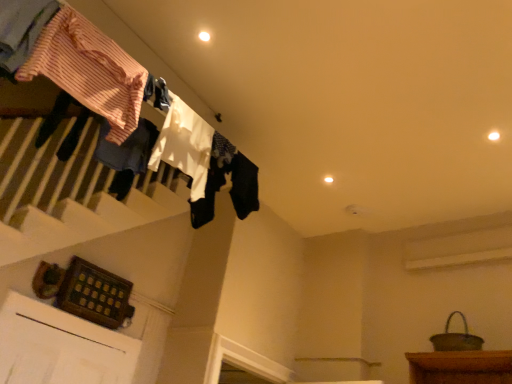
Question: In the image, is striped cotton shirt at upper left, positioned as the 1th clothing in front-to-back order, positioned in front of or behind white cotton socks at upper center, which is the 1th clothing in back-to-front order?

Choices:
 (A) behind
 (B) front

Answer: (B)

Question: From the image's perspective, is striped cotton shirt at upper left, positioned as the 1th clothing in front-to-back order, located above or below white cotton socks at upper center, arranged as the fourth clothing when viewed from the front?

Choices:
 (A) below
 (B) above

Answer: (B)

Question: Which object is the farthest from the striped cotton shirt at upper left, positioned as the 1th clothing in front-to-back order?

Choices:
 (A) white cotton socks at upper center, which is the 1th clothing in back-to-front order
 (B) striped cotton shirt at upper left, the third clothing in the back-to-front sequence
 (C) white fabric at upper center, the 3th clothing in the front-to-back sequence

Answer: (A)

Question: Estimate the real-world distances between objects in this image. Which object is closer to the striped cotton shirt at upper left, positioned as the 1th clothing in front-to-back order?

Choices:
 (A) white cotton socks at upper center, which is the 1th clothing in back-to-front order
 (B) striped cotton shirt at upper left, the third clothing in the back-to-front sequence
 (C) white fabric at upper center, the 3th clothing in the front-to-back sequence

Answer: (B)